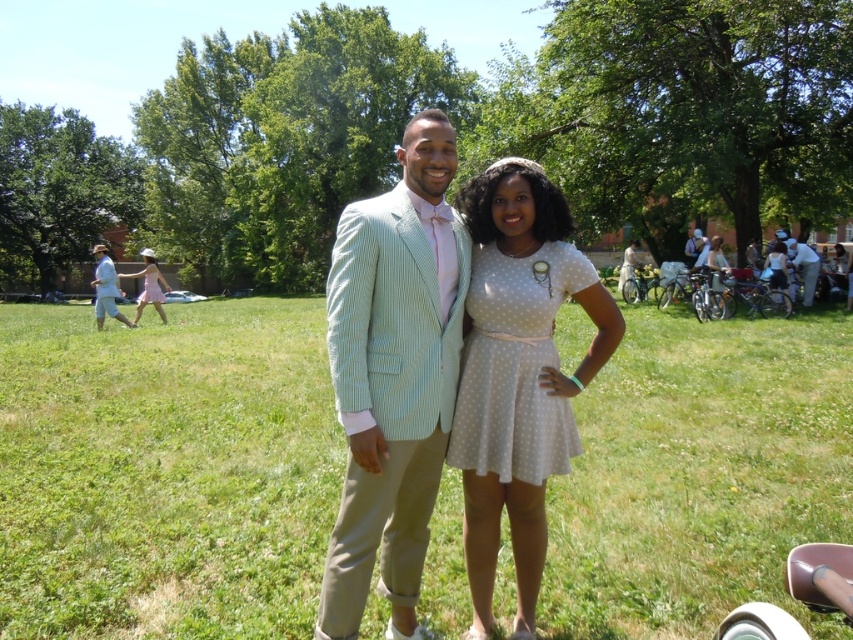
Question: Which point is farther to the camera?

Choices:
 (A) click(154, 275)
 (B) click(537, 257)
 (C) click(720, 308)

Answer: (A)

Question: Observing the image, what is the correct spatial positioning of green grass at center in reference to seersucker suit at center?

Choices:
 (A) right
 (B) left

Answer: (B)

Question: Is light pink polka dot dress at center closer to the viewer compared to pink polka dot dress at center?

Choices:
 (A) no
 (B) yes

Answer: (B)

Question: Which object is the closest to the white polka dot dress at center?

Choices:
 (A) seersucker suit at center
 (B) light pink fabric dress at left
 (C) pink polka dot dress at center

Answer: (A)

Question: Can you confirm if seersucker suit at center is positioned above white dotted dress at center?

Choices:
 (A) no
 (B) yes

Answer: (B)

Question: Which point is closer to the camera?

Choices:
 (A) (706, 259)
 (B) (144, 301)

Answer: (A)